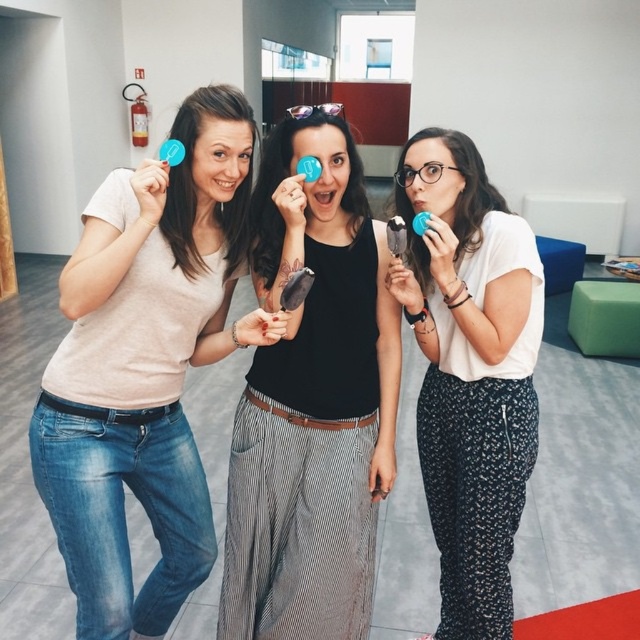
You are a photographer trying to capture a closeup shot of the black matte ice cream at center and the white matte shirt at center. Which object should you focus on first if you want to ensure both are in focus?

The black matte ice cream at center is positioned on the left side of white matte shirt at center. Since they are both at the same center position, focusing on either one should keep both in focus as they are aligned horizontally.